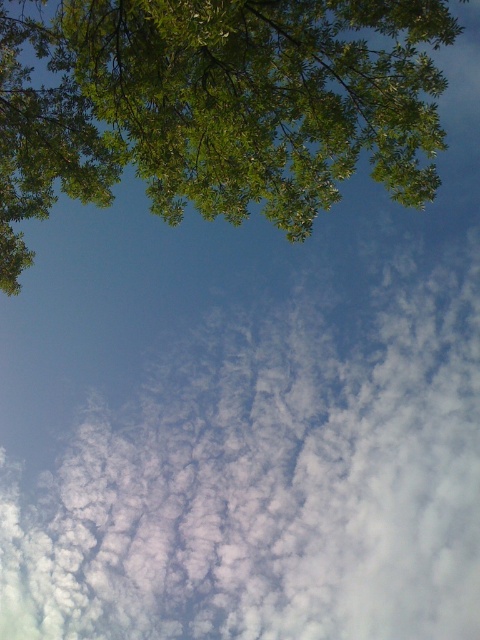
Based on the photo, does white fluffy cloud at upper center have a smaller size compared to green leafy tree at upper left?

Actually, white fluffy cloud at upper center might be larger than green leafy tree at upper left.

What do you see at coordinates (271, 481) in the screenshot? I see `white fluffy cloud at upper center` at bounding box center [271, 481].

Where is `white fluffy cloud at upper center`? This screenshot has width=480, height=640. white fluffy cloud at upper center is located at coordinates (271, 481).